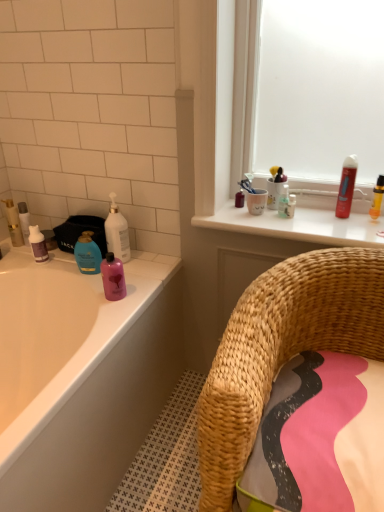
The width and height of the screenshot is (384, 512). Find the location of `free spot to the right of blue glossy lotion at left, placed as the 3th toiletry when sorted from left to right`. free spot to the right of blue glossy lotion at left, placed as the 3th toiletry when sorted from left to right is located at coordinates (142, 270).